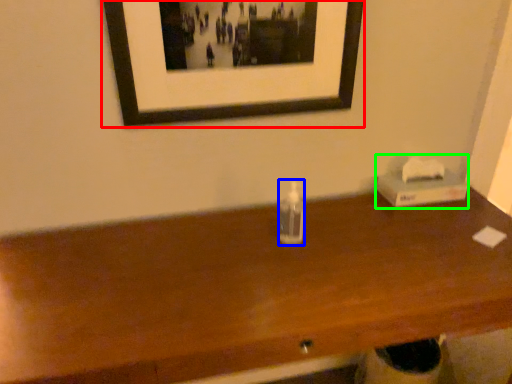
Question: Which object is the closest to the picture frame (highlighted by a red box)? Choose among these: bottle (highlighted by a blue box) or box (highlighted by a green box).

Choices:
 (A) bottle
 (B) box

Answer: (A)